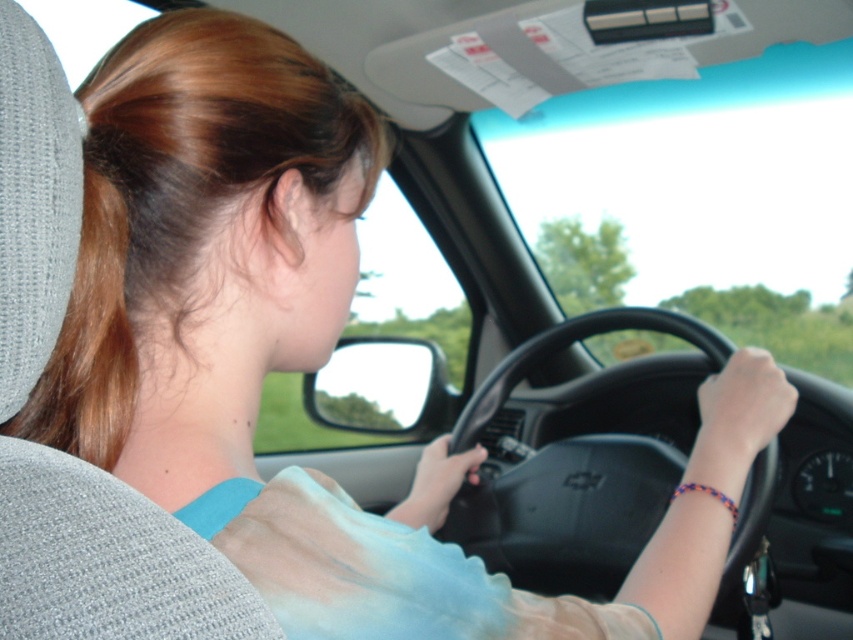
Question: Does black matte steering wheel at center have a lesser width compared to brown silky hair at left?

Choices:
 (A) no
 (B) yes

Answer: (A)

Question: Considering the relative positions of black matte steering wheel at center and brown silky hair at left in the image provided, where is black matte steering wheel at center located with respect to brown silky hair at left?

Choices:
 (A) right
 (B) left

Answer: (A)

Question: Does black matte steering wheel at center have a lesser width compared to brown silky hair at left?

Choices:
 (A) no
 (B) yes

Answer: (A)

Question: Which object is closer to the camera taking this photo?

Choices:
 (A) black matte steering wheel at center
 (B) brown silky hair at left

Answer: (B)